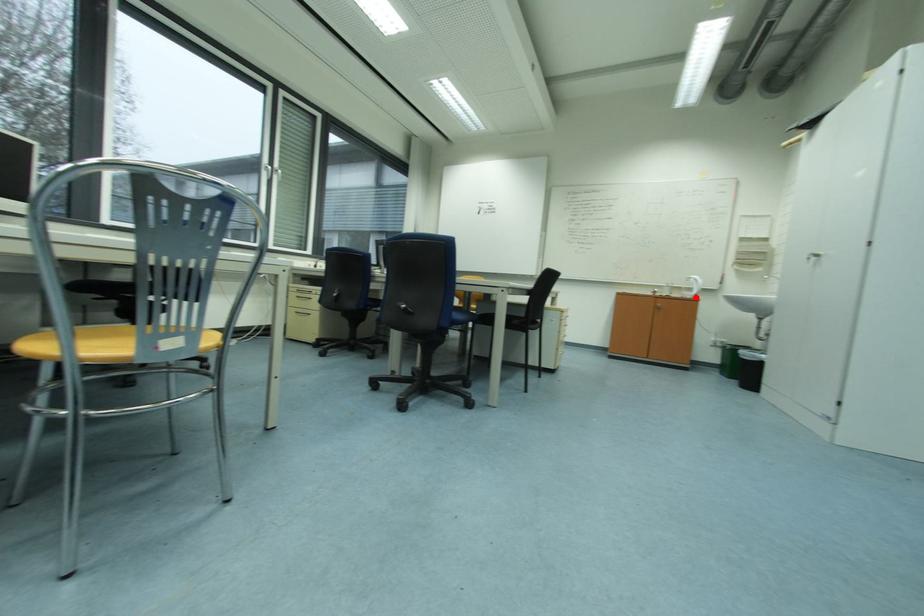
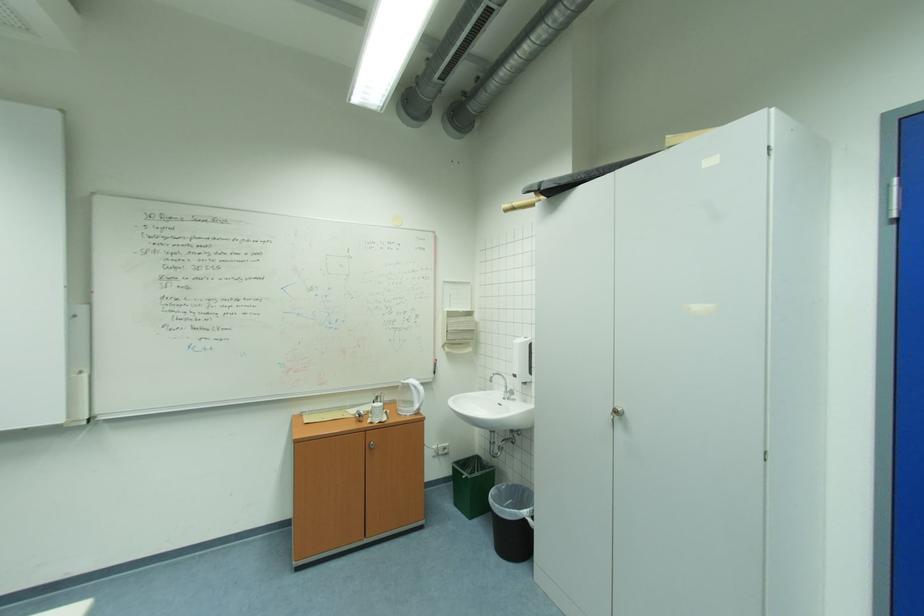
Question: I am providing you with two images of the same scene from different viewpoints. In image1, a red point is highlighted. Considering the same 3D point in image2, which of the following is correct?

Choices:
 (A) It is closer
 (B) It is farther

Answer: (B)